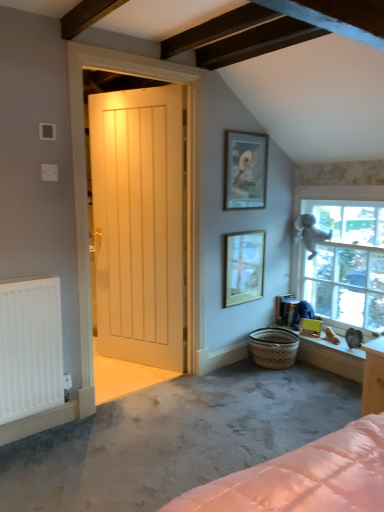
Image resolution: width=384 pixels, height=512 pixels. Identify the location of free location in front of white wooden door at center. (133, 378).